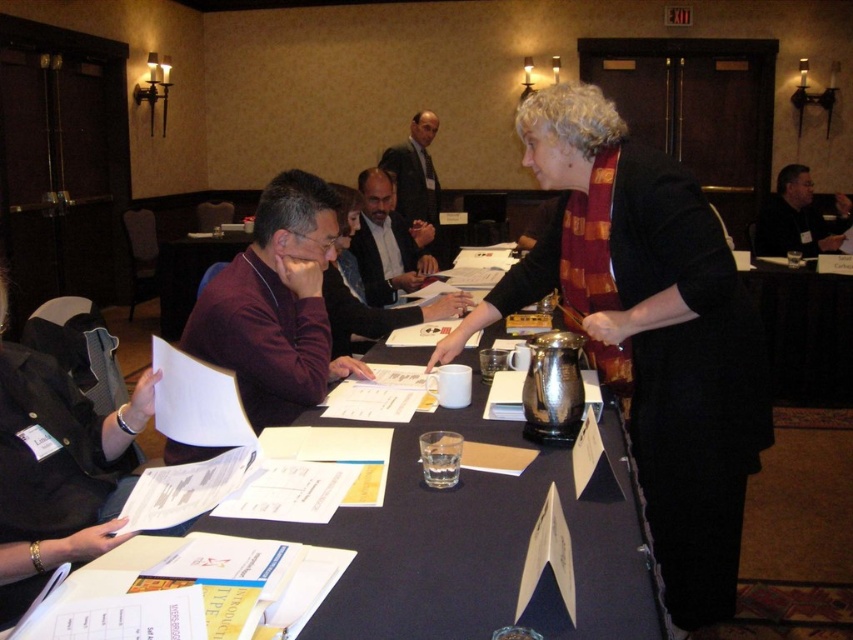
You are a guest arriving for a meeting and see the maroon scarf at center and the dark brown leather jacket at center on the table. Which item is closer to the edge of the table?

The maroon scarf at center is located below the dark brown leather jacket at center. Since the scarf is below the jacket, it is closer to the edge of the table.

You are a guest attending a meeting and need to reach the dark brown leather jacket at center from the maroon scarf at center. The space between them is narrow. Can you walk through the gap between them without touching either?

The maroon scarf at center is 1.54 meters from the dark brown leather jacket at center, so yes, you can walk through the gap between them without touching either since 1.54 meters is a sufficient distance for a person to pass through comfortably.